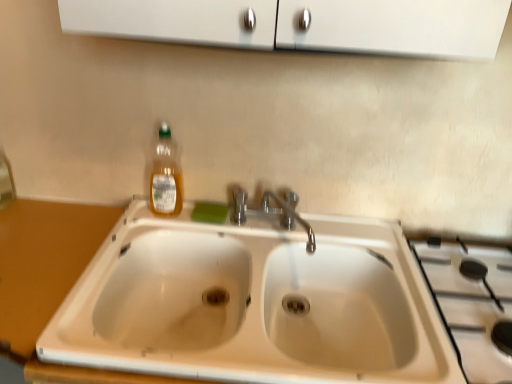
Locate an element on the screen. free space on the front side of translucent plastic bottle at upper left is located at coordinates (146, 230).